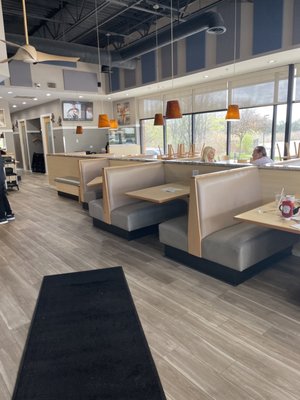
This screenshot has height=400, width=300. Identify the location of restaurant chairs. (187, 151), (168, 148), (285, 151).